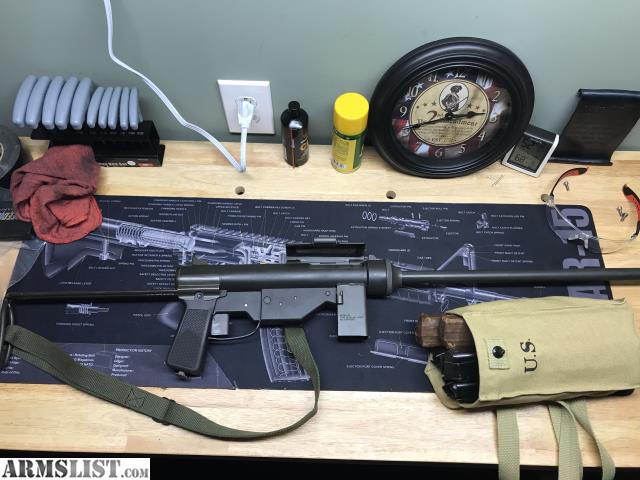
At what (x,y) coordinates should I click in order to perform the action: click on wooden table. Please return your answer as a coordinate pair (x, y). The height and width of the screenshot is (480, 640). Looking at the image, I should click on (495, 179).